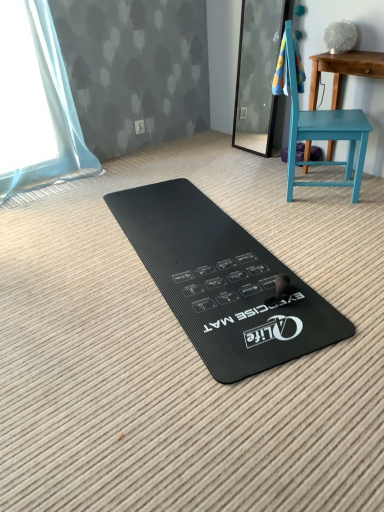
The width and height of the screenshot is (384, 512). What are the coordinates of `free spot below teal matte chair at right (from a real-world perspective)` in the screenshot? It's located at (320, 190).